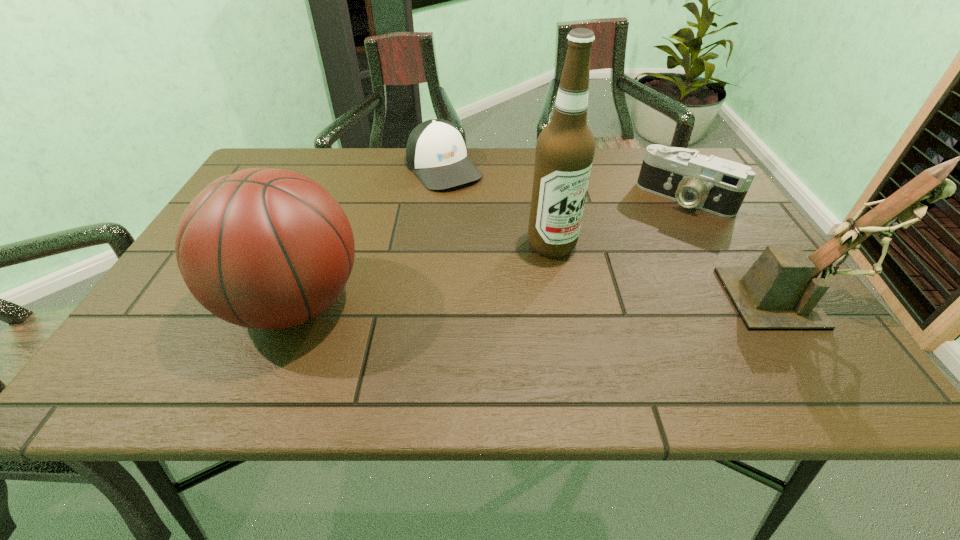
The image size is (960, 540). What are the coordinates of `free space in the image that satisfies the following two spatial constraints: 1. on the front side of the camera; 2. on the front-facing side of the figurine` in the screenshot? It's located at (744, 298).

Locate an element on the screen. vacant area that satisfies the following two spatial constraints: 1. on the back side of the leftmost object; 2. on the left side of the third object from left to right is located at coordinates (318, 245).

At what (x,y) coordinates should I click in order to perform the action: click on free space that satisfies the following two spatial constraints: 1. on the front side of the cap; 2. on the front-facing side of the figurine. Please return your answer as a coordinate pair (x, y). Looking at the image, I should click on (429, 298).